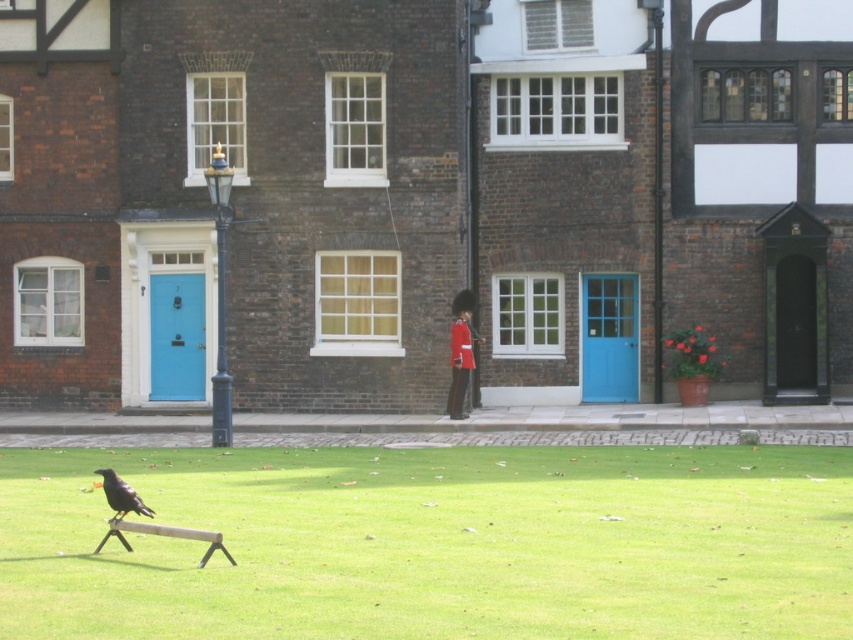
You are standing at point (461, 353) and see the shiny red uniform at center. What is located at this point?

The shiny red uniform at center is located at point (461, 353).